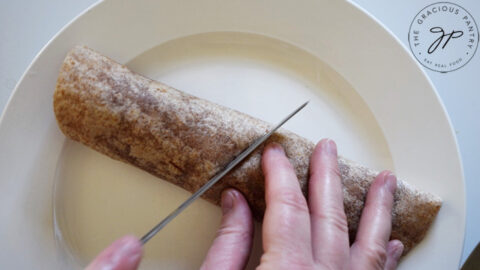
Locate an element on the screen. The height and width of the screenshot is (270, 480). white benchtop is located at coordinates (460, 92), (23, 29).